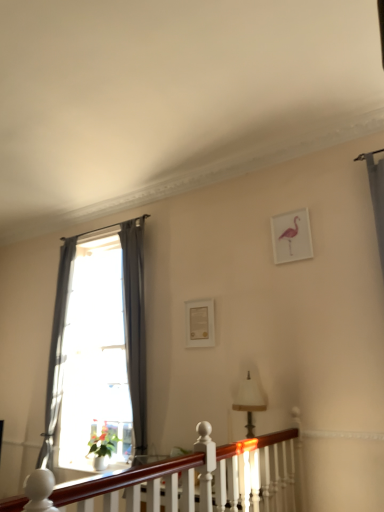
Question: Would you say matte white picture frame at center, which is the second picture frame from right to left, is inside or outside green matte flower at lower left?

Choices:
 (A) outside
 (B) inside

Answer: (A)

Question: Visually, is matte white picture frame at center, which is the first picture frame in left-to-right order, positioned to the left or to the right of green matte flower at lower left?

Choices:
 (A) left
 (B) right

Answer: (B)

Question: Based on their relative distances, which object is nearer to the gray fabric curtain at left, the second curtain in the right-to-left sequence?

Choices:
 (A) green matte flower at lower left
 (B) white fabric lampshade at center
 (C) transparent glass window at left
 (D) pink matte picture frame at upper right, placed as the 1th picture frame when sorted from right to left
 (E) gray fabric curtain at left, acting as the 1th curtain starting from the right

Answer: (C)

Question: Which is nearer to the gray fabric curtain at left, which is counted as the 2th curtain, starting from the left?

Choices:
 (A) matte white picture frame at center, which is the first picture frame in left-to-right order
 (B) green matte flower at lower left
 (C) gray fabric curtain at left, the second curtain in the right-to-left sequence
 (D) mahogany wood balustrade at lower center
 (E) white fabric lampshade at center

Answer: (A)